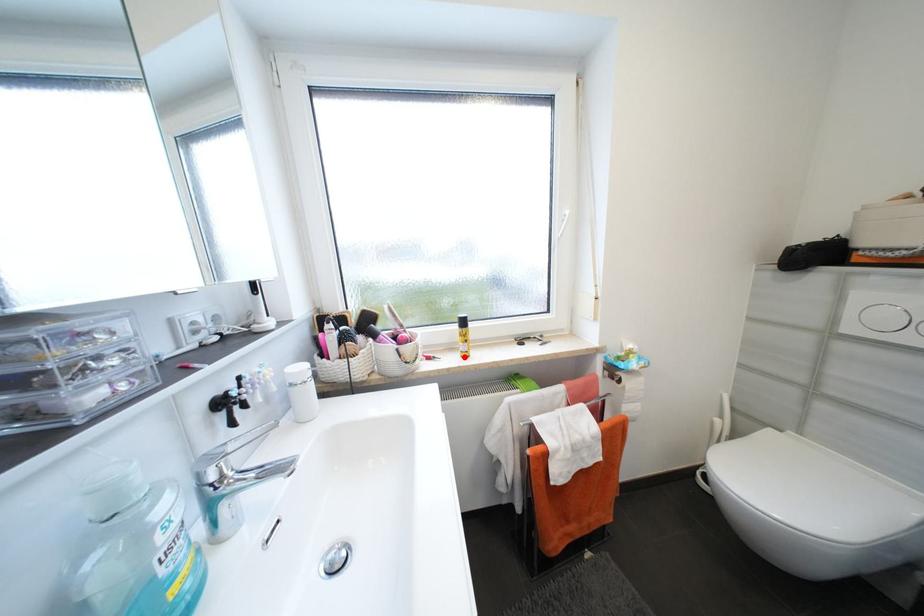
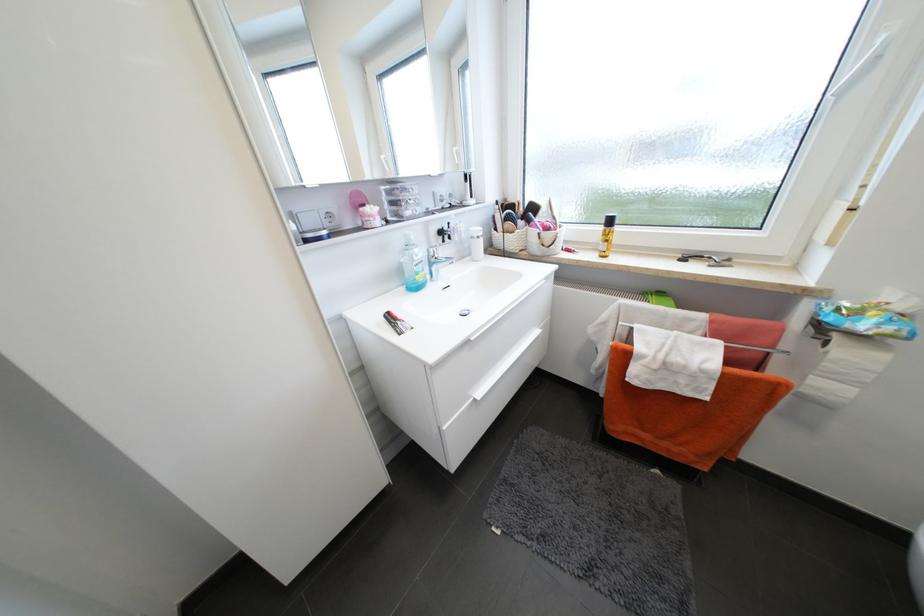
Where in the second image is the point corresponding to the highlighted location from the first image?

(602, 256)